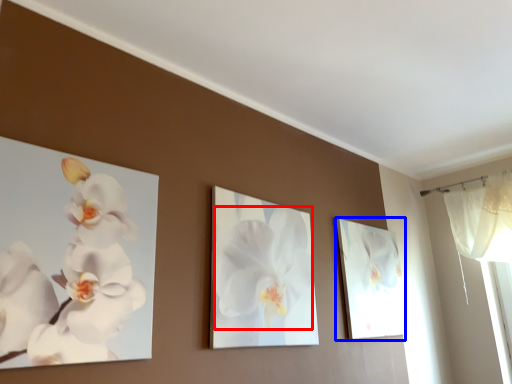
Question: Which object appears closest to the camera in this image, flower (highlighted by a red box) or picture frame (highlighted by a blue box)?

Choices:
 (A) flower
 (B) picture frame

Answer: (A)